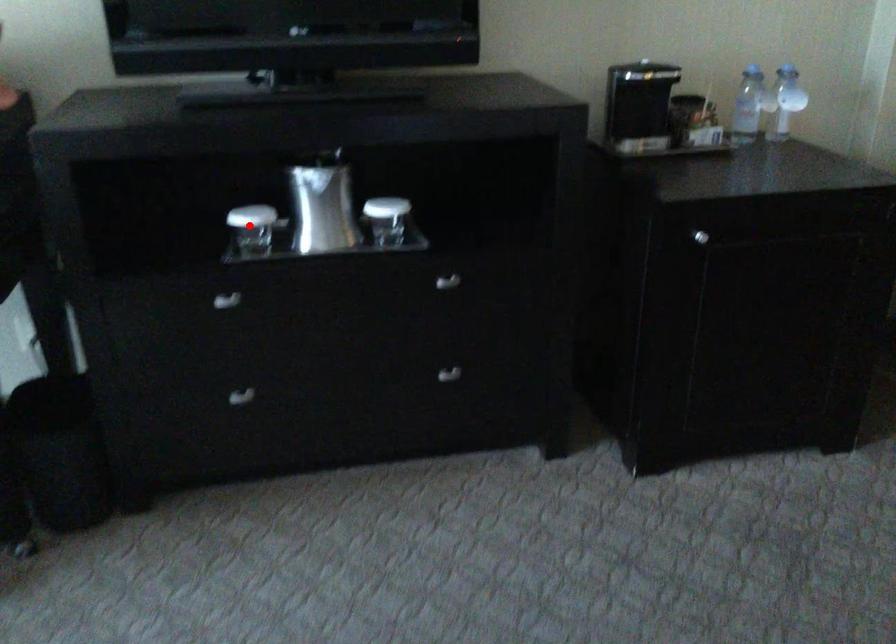
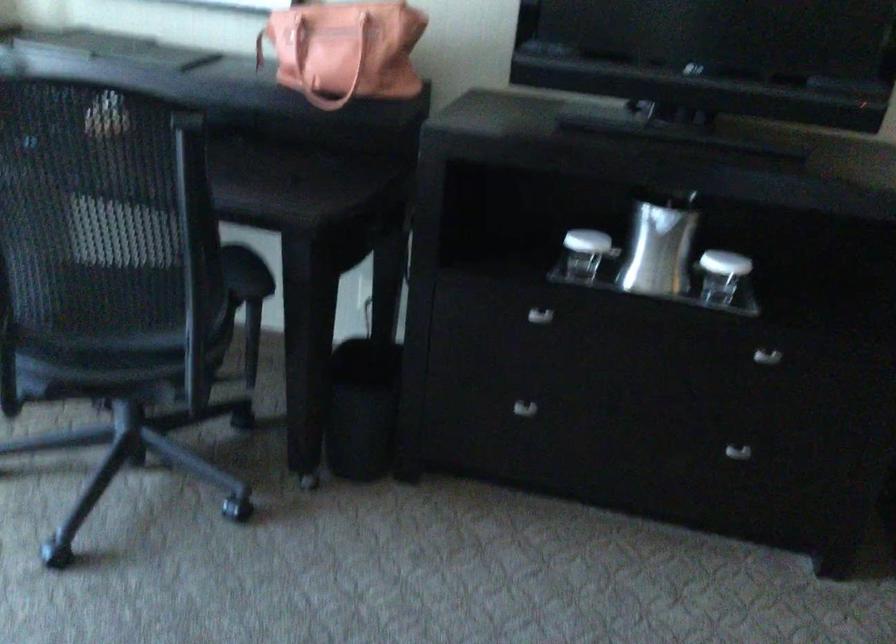
The point at the highlighted location is marked in the first image. Where is the corresponding point in the second image?

(586, 252)